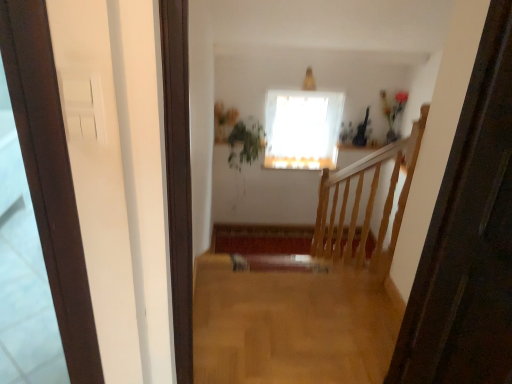
Question: Considering the relative positions of green leafy plant at upper center and white sheer curtain at upper center in the image provided, is green leafy plant at upper center to the right of white sheer curtain at upper center from the viewer's perspective?

Choices:
 (A) no
 (B) yes

Answer: (A)

Question: From a real-world perspective, is green leafy plant at upper center located higher than white sheer curtain at upper center?

Choices:
 (A) yes
 (B) no

Answer: (B)

Question: From the image's perspective, is green leafy plant at upper center below white sheer curtain at upper center?

Choices:
 (A) no
 (B) yes

Answer: (B)

Question: Is green leafy plant at upper center shorter than white sheer curtain at upper center?

Choices:
 (A) no
 (B) yes

Answer: (B)

Question: Is the depth of green leafy plant at upper center less than that of white sheer curtain at upper center?

Choices:
 (A) yes
 (B) no

Answer: (A)

Question: Does green leafy plant at upper center have a larger size compared to white sheer curtain at upper center?

Choices:
 (A) no
 (B) yes

Answer: (B)

Question: Can you confirm if light brown wood floor at center is thinner than green leafy plant at upper center?

Choices:
 (A) no
 (B) yes

Answer: (A)

Question: Is there a large distance between light brown wood floor at center and green leafy plant at upper center?

Choices:
 (A) yes
 (B) no

Answer: (A)

Question: Does light brown wood floor at center have a smaller size compared to green leafy plant at upper center?

Choices:
 (A) no
 (B) yes

Answer: (B)

Question: From the image's perspective, is light brown wood floor at center on top of green leafy plant at upper center?

Choices:
 (A) yes
 (B) no

Answer: (B)

Question: Is light brown wood floor at center shorter than green leafy plant at upper center?

Choices:
 (A) no
 (B) yes

Answer: (B)

Question: From a real-world perspective, is light brown wood floor at center beneath green leafy plant at upper center?

Choices:
 (A) yes
 (B) no

Answer: (B)

Question: Is white sheer curtain at upper center in contact with green leafy plant at upper center?

Choices:
 (A) no
 (B) yes

Answer: (A)